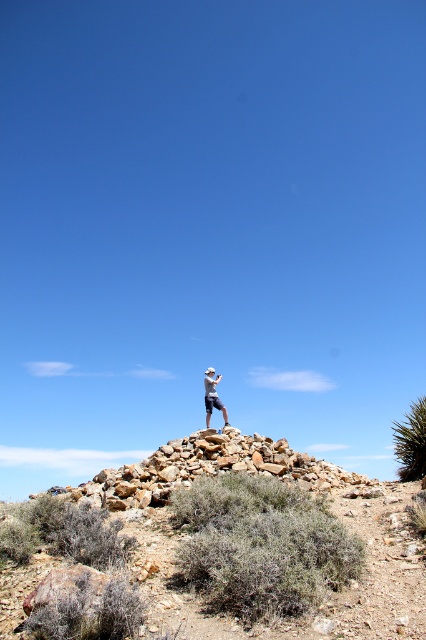
Based on the photo, you are navigating a desert terrain and need to locate the rockyroughrocky at center. According to the coordinates provided, where exactly would you find it?

The rockyroughrocky at center is located at the coordinates point (209,468).

You are standing at the base of the rocky mound in the desert scene. You notice a point marked at coordinates (209, 468). According to the image, where exactly is this point located?

The point at (209, 468) is located on the rockyroughrocky at center.